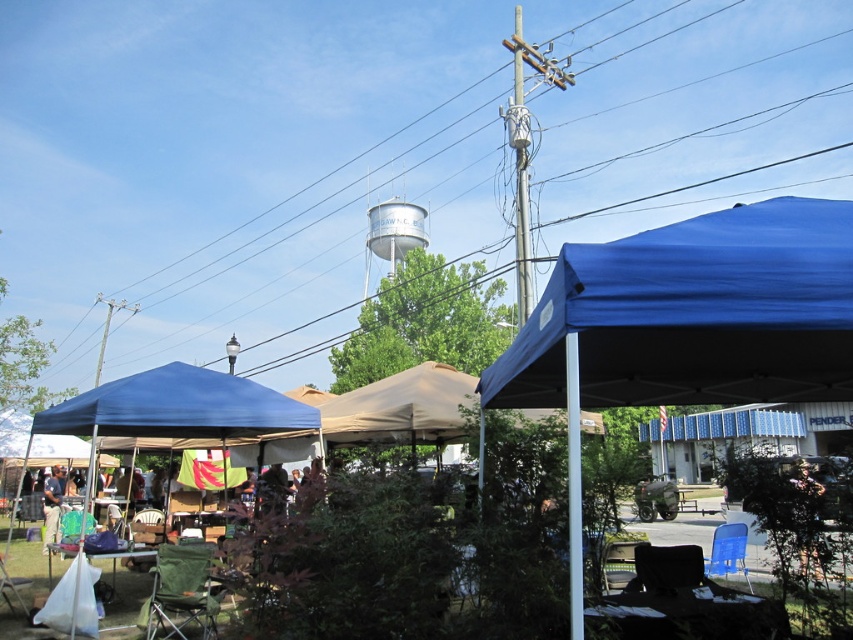
You are at the community fair and want to take a photo of both the white metallic water tower at upper center and the blue fabric chair at lower right. Can you position yourself so that the water tower appears to the left of the blue fabric chair in the photo?

Yes, since the white metallic water tower at upper center is already positioned on the left side of the blue fabric chair at lower right, you can take the photo from your current position to capture the water tower to the left of the chair.